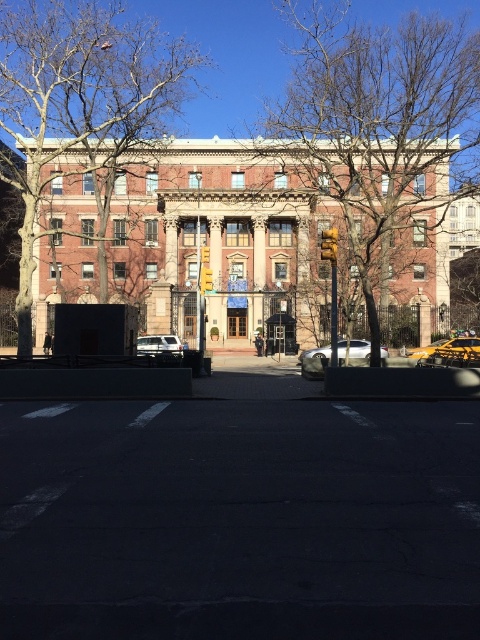
Which is above, brown leafless tree at center or white matte car at center?

Positioned higher is brown leafless tree at center.

Is point (367, 166) positioned after point (369, 348)?

Yes, it is behind point (369, 348).

In order to click on brown leafless tree at center in this screenshot , I will do `click(381, 125)`.

Identify the location of brown leafless tree at center. The image size is (480, 640). (381, 125).

Who is more distant from viewer, (311, 353) or (441, 340)?

The point (441, 340) is behind.

Does white matte car at center have a larger size compared to yellow matte taxi at right?

Actually, white matte car at center might be smaller than yellow matte taxi at right.

Who is more forward, (352, 349) or (471, 340)?

Point (471, 340)

Find the location of a particular element. white matte car at center is located at coordinates (314, 362).

Can you confirm if bare branches at left is positioned below white matte car at center?

Actually, bare branches at left is above white matte car at center.

Who is taller, bare branches at left or white matte car at center?

With more height is bare branches at left.

Measure the distance between bare branches at left and camera.

bare branches at left and camera are 72.38 feet apart from each other.

At what (x,y) coordinates should I click in order to perform the action: click on bare branches at left. Please return your answer as a coordinate pair (x, y). Looking at the image, I should click on (78, 100).